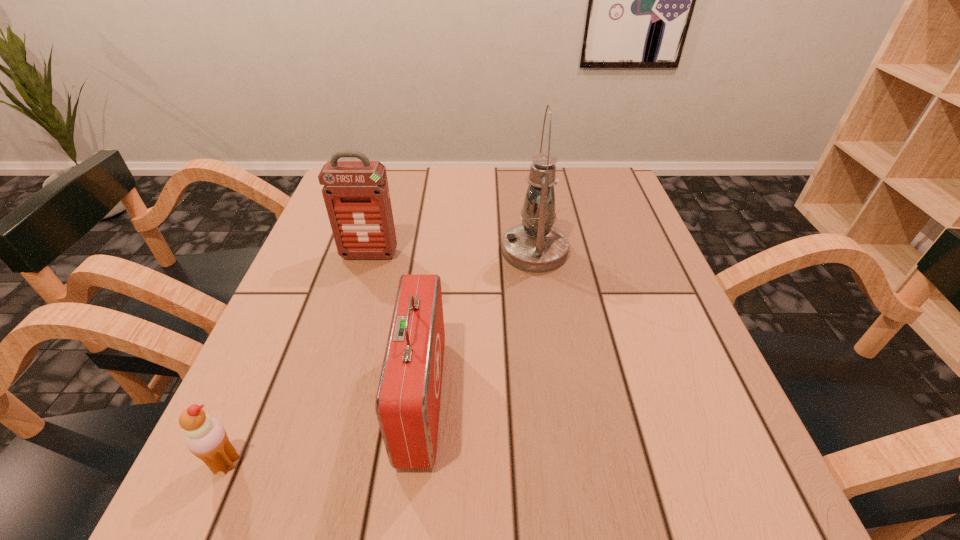
Find the location of `free space located on the side of the right first-aid kit with the first aid cross symbol`. free space located on the side of the right first-aid kit with the first aid cross symbol is located at coordinates (640, 399).

Identify the location of the first-aid kit at the near edge. Image resolution: width=960 pixels, height=540 pixels. (407, 406).

I want to click on icecream that is at the near edge, so click(x=206, y=438).

Locate an element on the screen. the first-aid kit that is at the left edge is located at coordinates (356, 194).

I want to click on icecream that is at the left edge, so click(206, 438).

Where is `object that is at the near left corner`? This screenshot has height=540, width=960. object that is at the near left corner is located at coordinates (206, 438).

Locate an element on the screen. This screenshot has height=540, width=960. blank area at the far edge is located at coordinates (513, 185).

Where is `vacant region at the near edge of the desktop`? vacant region at the near edge of the desktop is located at coordinates (482, 491).

At what (x,y) coordinates should I click in order to perform the action: click on free space at the left edge. Please return your answer as a coordinate pair (x, y). This screenshot has width=960, height=540. Looking at the image, I should click on (233, 418).

In the image, there is a desktop. What are the coordinates of `vacant space at the right edge` in the screenshot? It's located at (613, 222).